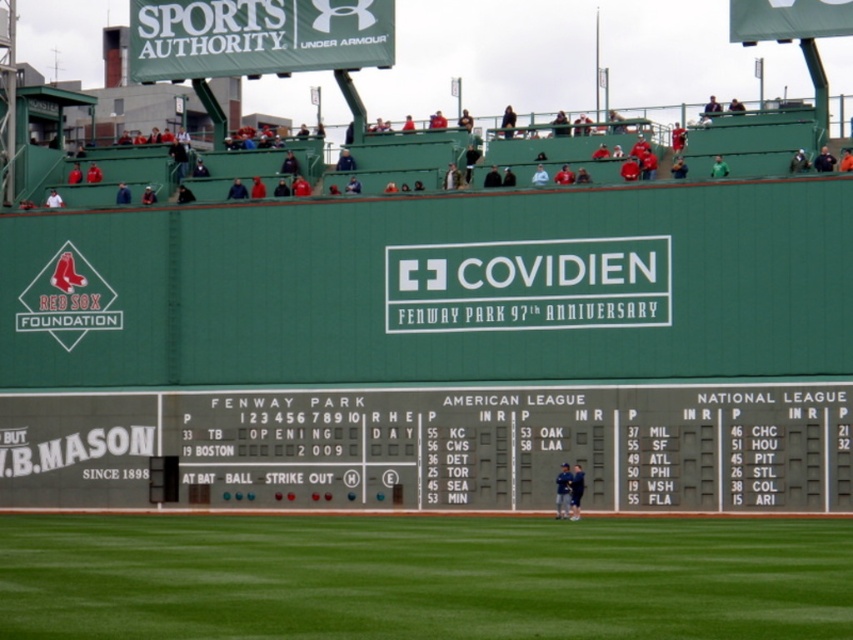
You are a drone operator trying to capture a photo of the gray metal scoreboard at center. The drone is currently at point A, which is at coordinates 0.6, 0.5. To ensure the scoreboard is centered in the photo, should you move the drone north or south? Please provide your answer based on the scoreboard position at point 0.698, 0.513.

The gray metal scoreboard at center is located at point (437, 445). Since the drone is at (426, 384), which is to the southwest of the scoreboard, you should move the drone northeast to center it in the photo.

From the picture: You are a photographer standing at the edge of Fenway Park, wanting to capture both the gray metal scoreboard at center and the dark blue uniform at center in a single photo. Given that your camera has a maximum focus range of 25 feet, will you be able to capture both objects clearly in the same photo?

The gray metal scoreboard at center and dark blue uniform at center are 28.85 feet apart. Since the distance between them exceeds the camera maximum focus range of 25 feet, you won not be able to capture both objects clearly in the same photo.